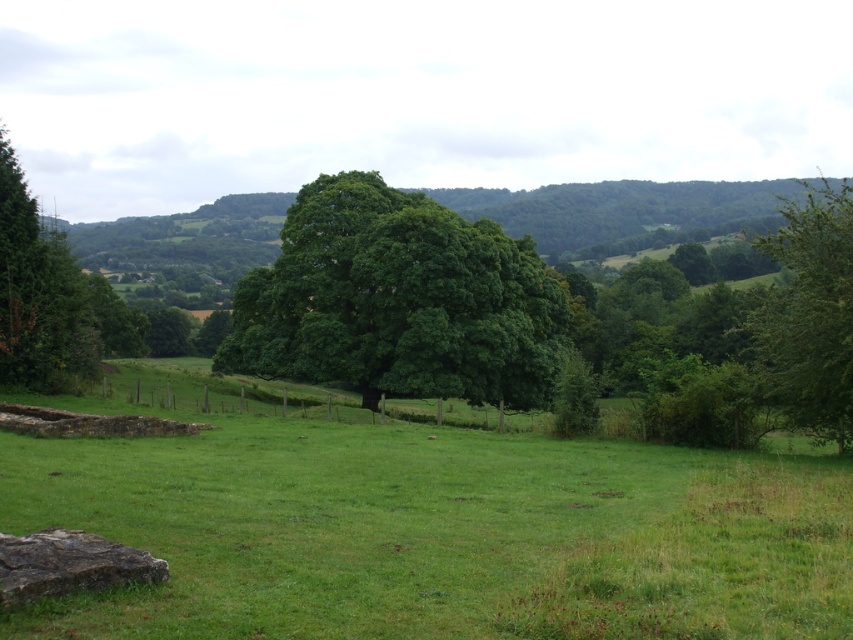
Question: Can you confirm if green leafy tree at right is positioned below green leafy tree at left?

Choices:
 (A) no
 (B) yes

Answer: (A)

Question: Is green grass at center below green leafy tree at left?

Choices:
 (A) no
 (B) yes

Answer: (B)

Question: Among these objects, which one is farthest from the camera?

Choices:
 (A) green grass at center
 (B) green leafy tree at center
 (C) green leafy tree at left
 (D) green leafy tree at right

Answer: (B)

Question: Which point appears closest to the camera in this image?

Choices:
 (A) (3, 195)
 (B) (315, 232)

Answer: (A)

Question: Which point is farther from the camera taking this photo?

Choices:
 (A) (537, 376)
 (B) (24, 353)
 (C) (334, 504)

Answer: (A)

Question: Does green grass at center appear under green leafy tree at left?

Choices:
 (A) no
 (B) yes

Answer: (B)